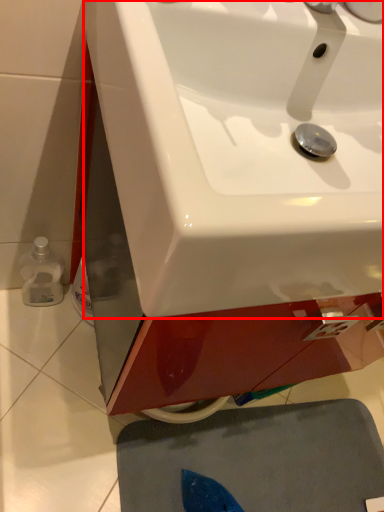
Question: In this image, where is sink (annotated by the red box) located relative to bath mat?

Choices:
 (A) left
 (B) right

Answer: (A)